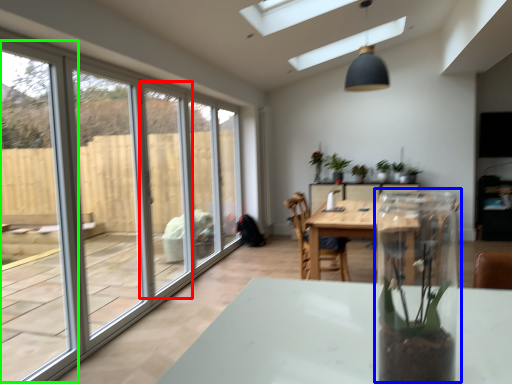
Question: Which object is positioned closest to screen door (highlighted by a red box)? Select from glass box (highlighted by a blue box) and window frame (highlighted by a green box).

Choices:
 (A) glass box
 (B) window frame

Answer: (A)